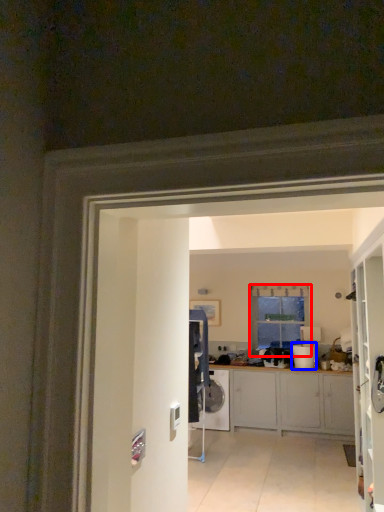
Question: Which of the following is the closest to the observer, window (highlighted by a red box) or appliance (highlighted by a blue box)?

Choices:
 (A) window
 (B) appliance

Answer: (B)